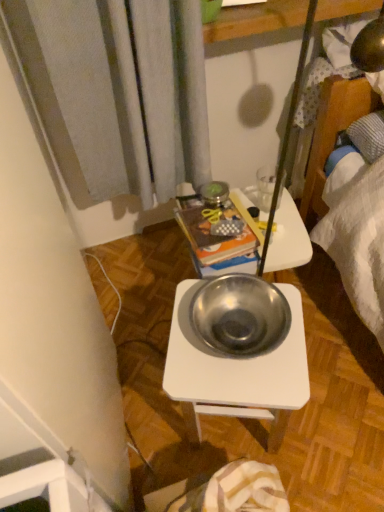
Question: Relative to metallic silver bowl at center, is metallic white desk at center in front or behind?

Choices:
 (A) front
 (B) behind

Answer: (B)

Question: From a real-world perspective, is metallic white desk at center positioned above or below metallic silver bowl at center?

Choices:
 (A) below
 (B) above

Answer: (A)

Question: Estimate the real-world distances between objects in this image. Which object is closer to the metallic white desk at center?

Choices:
 (A) metallic books at center
 (B) metallic silver bowl at center
 (C) transparent glass at upper center

Answer: (B)

Question: Considering the real-world distances, which object is farthest from the metallic silver bowl at center?

Choices:
 (A) metallic books at center
 (B) transparent glass at upper center
 (C) metallic white desk at center

Answer: (B)